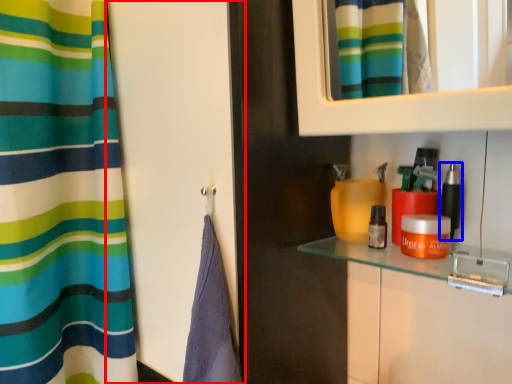
Question: Which object is closer to the camera taking this photo, screen door (highlighted by a red box) or cosmetic (highlighted by a blue box)?

Choices:
 (A) screen door
 (B) cosmetic

Answer: (A)